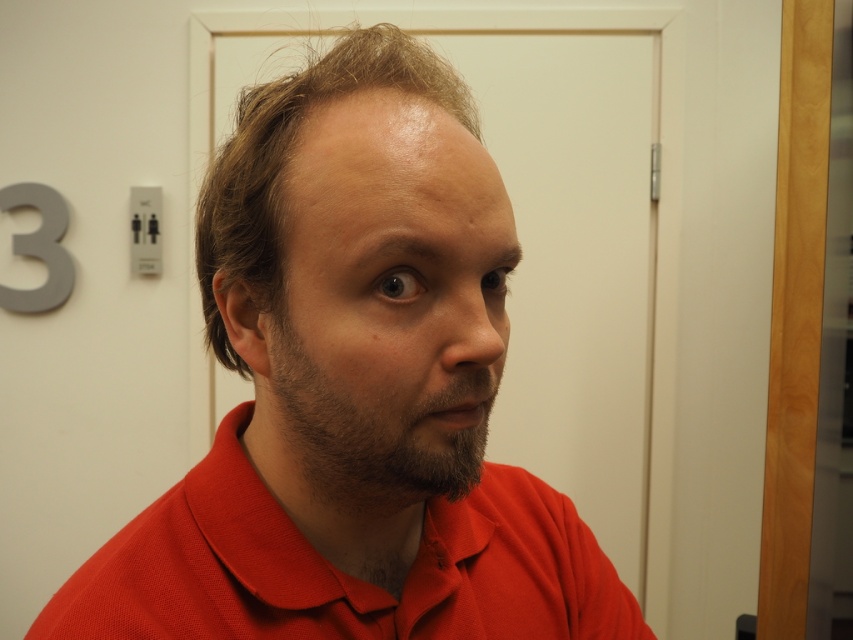
Question: Which object is positioned farthest from the brown matte hair at center?

Choices:
 (A) red matte shirt at center
 (B) brown fuzzy beard at center
 (C) matte red polo shirt at center

Answer: (C)

Question: From the image, what is the correct spatial relationship of red matte shirt at center in relation to brown matte hair at center?

Choices:
 (A) left
 (B) right

Answer: (B)

Question: Does matte red polo shirt at center have a greater width compared to brown matte hair at center?

Choices:
 (A) no
 (B) yes

Answer: (B)

Question: Which of the following is the farthest from the observer?

Choices:
 (A) red matte shirt at center
 (B) matte red polo shirt at center
 (C) brown matte hair at center

Answer: (B)

Question: Which of the following is the closest to the observer?

Choices:
 (A) (427, 433)
 (B) (352, 449)
 (C) (250, 508)

Answer: (A)

Question: Is brown fuzzy beard at center closer to the viewer compared to brown matte hair at center?

Choices:
 (A) no
 (B) yes

Answer: (B)